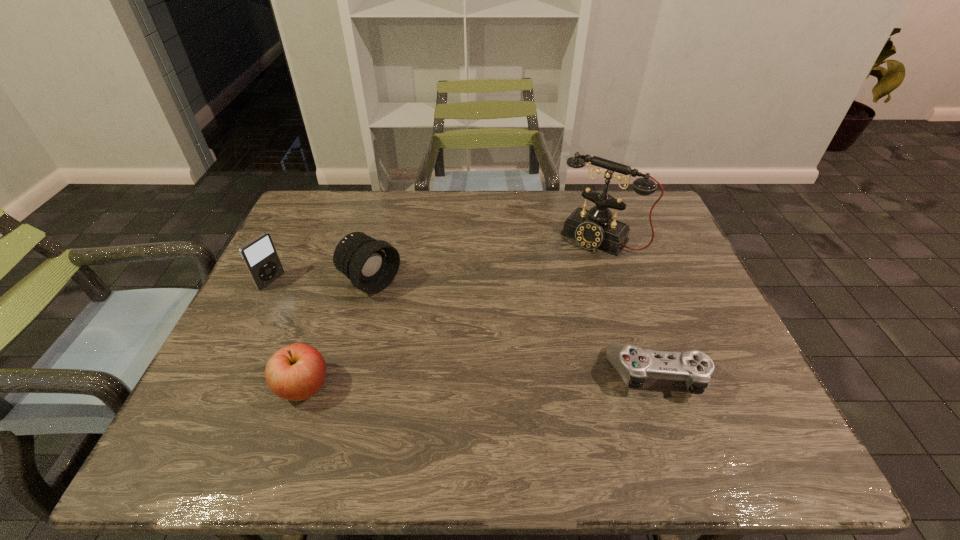
At what (x,y) coordinates should I click in order to perform the action: click on the fourth tallest object. Please return your answer as a coordinate pair (x, y). Looking at the image, I should click on (296, 372).

You are a GUI agent. You are given a task and a screenshot of the screen. Output one action in this format:
    pyautogui.click(x=<x>, y=<y>)
    Task: Click on the control
    Image resolution: width=960 pixels, height=540 pixels.
    Given the screenshot: What is the action you would take?
    pyautogui.click(x=634, y=364)

In order to click on the leftmost object in this screenshot , I will do `click(259, 255)`.

The image size is (960, 540). I want to click on telephone, so click(593, 229).

You are a GUI agent. You are given a task and a screenshot of the screen. Output one action in this format:
    pyautogui.click(x=<x>, y=<y>)
    Task: Click on the tallest object
    Image resolution: width=960 pixels, height=540 pixels.
    Given the screenshot: What is the action you would take?
    pyautogui.click(x=593, y=229)

At what (x,y) coordinates should I click in order to perform the action: click on telephoto lens. Please return your answer as a coordinate pair (x, y). Looking at the image, I should click on (371, 265).

Find the location of `free location located on the right of the fourth tallest object`. free location located on the right of the fourth tallest object is located at coordinates (456, 387).

In order to click on vacant space located on the left of the control in this screenshot , I will do 468,375.

Where is `blank space located 0.090m on the front-facing side of the iPod`? The height and width of the screenshot is (540, 960). blank space located 0.090m on the front-facing side of the iPod is located at coordinates (300, 299).

Where is `vacant space located on the front-facing side of the iPod`? The image size is (960, 540). vacant space located on the front-facing side of the iPod is located at coordinates (306, 302).